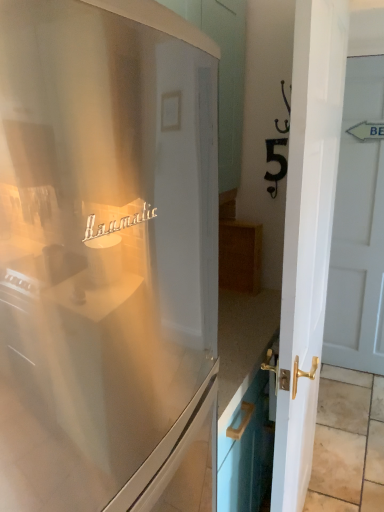
Question: Considering the relative sizes of satin white refrigerator at center and white glossy door at right, which is the 2th door from front to back, in the image provided, is satin white refrigerator at center smaller than white glossy door at right, which is the 2th door from front to back,?

Choices:
 (A) no
 (B) yes

Answer: (A)

Question: Is satin white refrigerator at center at the right side of white glossy door at right, which is the 2th door from front to back?

Choices:
 (A) yes
 (B) no

Answer: (B)

Question: From the image's perspective, does satin white refrigerator at center appear lower than white glossy door at right, the 1th door in the right-to-left sequence?

Choices:
 (A) no
 (B) yes

Answer: (B)

Question: Can you confirm if satin white refrigerator at center is thinner than white glossy door at right, the 1th door in the right-to-left sequence?

Choices:
 (A) no
 (B) yes

Answer: (A)

Question: Can you confirm if satin white refrigerator at center is bigger than white glossy door at right, which is the 2th door from front to back?

Choices:
 (A) no
 (B) yes

Answer: (B)

Question: Is white glossy door at right, acting as the second door starting from the left, located within satin white refrigerator at center?

Choices:
 (A) yes
 (B) no

Answer: (B)

Question: Would you say white glossy door at right, the 1th door in the right-to-left sequence, contains satin white refrigerator at center?

Choices:
 (A) no
 (B) yes

Answer: (A)

Question: Considering the relative sizes of white glossy door at right, which appears as the 1th door when viewed from the back, and satin white refrigerator at center in the image provided, is white glossy door at right, which appears as the 1th door when viewed from the back, bigger than satin white refrigerator at center?

Choices:
 (A) no
 (B) yes

Answer: (A)

Question: Does white glossy door at right, the 1th door in the right-to-left sequence, appear on the left side of satin white refrigerator at center?

Choices:
 (A) no
 (B) yes

Answer: (A)

Question: Is white glossy door at right, the 1th door in the right-to-left sequence, aimed at satin white refrigerator at center?

Choices:
 (A) yes
 (B) no

Answer: (A)

Question: Considering the relative positions of white glossy door at right, which is the 2th door from front to back, and satin white refrigerator at center in the image provided, is white glossy door at right, which is the 2th door from front to back, to the right of satin white refrigerator at center from the viewer's perspective?

Choices:
 (A) no
 (B) yes

Answer: (B)

Question: Is white glossy door at right, which is the 2th door from front to back, turned away from satin white refrigerator at center?

Choices:
 (A) yes
 (B) no

Answer: (B)

Question: Does satin white refrigerator at center come behind white glossy door at right, which is counted as the first door, starting from the left?

Choices:
 (A) no
 (B) yes

Answer: (A)